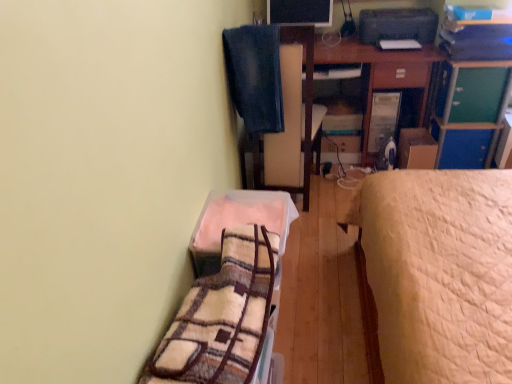
The image size is (512, 384). Describe the element at coordinates (473, 91) in the screenshot. I see `green matte file cabinet at upper right` at that location.

Where is `denim at upper center, placed as the first blanket when sorted from top to bottom`? The width and height of the screenshot is (512, 384). denim at upper center, placed as the first blanket when sorted from top to bottom is located at coordinates (255, 76).

What do you see at coordinates (255, 76) in the screenshot? Image resolution: width=512 pixels, height=384 pixels. I see `denim at upper center, the second blanket when ordered from bottom to top` at bounding box center [255, 76].

How much space does plush beige blanket at lower center, acting as the 1th blanket starting from the bottom, occupy vertically?

plush beige blanket at lower center, acting as the 1th blanket starting from the bottom, is 7.21 inches tall.

This screenshot has width=512, height=384. What do you see at coordinates (380, 72) in the screenshot?
I see `wooden desk at upper right` at bounding box center [380, 72].

You are a GUI agent. You are given a task and a screenshot of the screen. Output one action in this format:
    pyautogui.click(x=<x>, y=<y>)
    Task: Click on the denim fabric swivel chair at upper center
    
    Given the screenshot: What is the action you would take?
    pos(305,111)

Is green matte file cabinet at upper right bigger or smaller than fuzzy fabric blanket at lower left?

In the image, green matte file cabinet at upper right appears to be smaller than fuzzy fabric blanket at lower left.

Between green matte file cabinet at upper right and fuzzy fabric blanket at lower left, which one appears on the right side from the viewer's perspective?

Positioned to the right is green matte file cabinet at upper right.

Can you confirm if green matte file cabinet at upper right is taller than fuzzy fabric blanket at lower left?

Correct, green matte file cabinet at upper right is much taller as fuzzy fabric blanket at lower left.

From a real-world perspective, does green matte file cabinet at upper right stand above fuzzy fabric blanket at lower left?

Yes.

Considering the positions of objects plush beige blanket at lower center, placed as the 2th blanket when sorted from top to bottom, and wooden desk at upper right in the image provided, who is more to the left, plush beige blanket at lower center, placed as the 2th blanket when sorted from top to bottom, or wooden desk at upper right?

Positioned to the left is plush beige blanket at lower center, placed as the 2th blanket when sorted from top to bottom.

Who is taller, plush beige blanket at lower center, acting as the first blanket starting from the front, or wooden desk at upper right?

wooden desk at upper right.

From a real-world perspective, relative to wooden desk at upper right, is plush beige blanket at lower center, positioned as the 2th blanket in back-to-front order, vertically above or below?

plush beige blanket at lower center, positioned as the 2th blanket in back-to-front order, is above wooden desk at upper right.

Is plush beige blanket at lower center, acting as the 1th blanket starting from the bottom, next to wooden desk at upper right?

No, plush beige blanket at lower center, acting as the 1th blanket starting from the bottom, is not beside wooden desk at upper right.

Between matte black monitor at upper center and denim fabric swivel chair at upper center, which one has more height?

Standing taller between the two is denim fabric swivel chair at upper center.

Is matte black monitor at upper center situated inside denim fabric swivel chair at upper center or outside?

matte black monitor at upper center exists outside the volume of denim fabric swivel chair at upper center.

Does matte black monitor at upper center have a larger size compared to denim fabric swivel chair at upper center?

No, matte black monitor at upper center is not bigger than denim fabric swivel chair at upper center.

Between matte black monitor at upper center and denim fabric swivel chair at upper center, which one appears on the right side from the viewer's perspective?

matte black monitor at upper center is more to the right.

Considering the relative positions of wooden desk at upper right and green matte file cabinet at upper right in the image provided, is wooden desk at upper right behind green matte file cabinet at upper right?

Yes, wooden desk at upper right is further from the viewer.

In terms of height, does wooden desk at upper right look taller or shorter compared to green matte file cabinet at upper right?

In the image, wooden desk at upper right appears to be taller than green matte file cabinet at upper right.

Is wooden desk at upper right outside of green matte file cabinet at upper right?

Yes, wooden desk at upper right is located beyond the bounds of green matte file cabinet at upper right.

In the scene shown: Is plush beige blanket at lower center, acting as the first blanket starting from the front, taller or shorter than denim at upper center, placed as the first blanket when sorted from top to bottom?

plush beige blanket at lower center, acting as the first blanket starting from the front, is shorter than denim at upper center, placed as the first blanket when sorted from top to bottom.

Is there a large distance between plush beige blanket at lower center, positioned as the 2th blanket in back-to-front order, and denim at upper center, which is the 1th blanket from back to front?

No, plush beige blanket at lower center, positioned as the 2th blanket in back-to-front order, is not far away from denim at upper center, which is the 1th blanket from back to front.

How different are the orientations of plush beige blanket at lower center, acting as the 1th blanket starting from the bottom, and denim at upper center, which is the 1th blanket from back to front, in degrees?

The angle between the facing direction of plush beige blanket at lower center, acting as the 1th blanket starting from the bottom, and the facing direction of denim at upper center, which is the 1th blanket from back to front, is 85.7 degrees.

Is plush beige blanket at lower center, acting as the 1th blanket starting from the bottom, in front of or behind denim at upper center, placed as the first blanket when sorted from top to bottom, in the image?

plush beige blanket at lower center, acting as the 1th blanket starting from the bottom, is positioned closer to the viewer than denim at upper center, placed as the first blanket when sorted from top to bottom.

Considering the positions of point (272, 8) and point (205, 225), is point (272, 8) closer or farther from the camera than point (205, 225)?

Point (272, 8).

The height and width of the screenshot is (384, 512). In order to click on computer monitor located above the plush beige blanket at lower center, positioned as the 2th blanket in back-to-front order (from the image's perspective) in this screenshot , I will do `click(300, 12)`.

From a real-world perspective, is matte black monitor at upper center physically located above or below plush beige blanket at lower center, acting as the first blanket starting from the front?

From a real-world perspective, matte black monitor at upper center is physically above plush beige blanket at lower center, acting as the first blanket starting from the front.

Can you confirm if matte black monitor at upper center is thinner than plush beige blanket at lower center, acting as the 1th blanket starting from the bottom?

Indeed, matte black monitor at upper center has a lesser width compared to plush beige blanket at lower center, acting as the 1th blanket starting from the bottom.

Considering the relative sizes of denim fabric swivel chair at upper center and denim at upper center, placed as the first blanket when sorted from top to bottom, in the image provided, is denim fabric swivel chair at upper center wider than denim at upper center, placed as the first blanket when sorted from top to bottom,?

Indeed, denim fabric swivel chair at upper center has a greater width compared to denim at upper center, placed as the first blanket when sorted from top to bottom.

Is denim fabric swivel chair at upper center to the left or to the right of denim at upper center, the second blanket in the front-to-back sequence, in the image?

denim fabric swivel chair at upper center is positioned on denim at upper center, the second blanket in the front-to-back sequence,'s right side.

Could you tell me if denim fabric swivel chair at upper center is facing denim at upper center, which is the 1th blanket from back to front?

Yes, denim fabric swivel chair at upper center is oriented towards denim at upper center, which is the 1th blanket from back to front.

Considering the points (306, 195) and (278, 63), which point is in front, point (306, 195) or point (278, 63)?

Positioned in front is point (278, 63).

Locate an element on the screen. The width and height of the screenshot is (512, 384). file cabinet on the right of fuzzy fabric blanket at lower left is located at coordinates [473, 91].

At what (x,y) coordinates should I click in order to perform the action: click on table below the plush beige blanket at lower center, acting as the 1th blanket starting from the bottom (from a real-world perspective). Please return your answer as a coordinate pair (x, y). The height and width of the screenshot is (384, 512). Looking at the image, I should click on (380, 72).

Which object lies nearer to the anchor point denim at upper center, the second blanket when ordered from bottom to top, fuzzy fabric blanket at lower left or wooden desk at upper right?

The object closer to denim at upper center, the second blanket when ordered from bottom to top, is wooden desk at upper right.

Looking at the image, which one is located further to plush beige blanket at lower center, acting as the 1th blanket starting from the bottom, denim fabric swivel chair at upper center or green matte file cabinet at upper right?

The object further to plush beige blanket at lower center, acting as the 1th blanket starting from the bottom, is green matte file cabinet at upper right.

Considering their positions, is denim at upper center, the second blanket in the front-to-back sequence, positioned further to green matte file cabinet at upper right than plush beige blanket at lower center, acting as the 1th blanket starting from the bottom?

plush beige blanket at lower center, acting as the 1th blanket starting from the bottom.

Based on their spatial positions, is fuzzy fabric blanket at lower left or denim at upper center, placed as the first blanket when sorted from top to bottom, further from wooden desk at upper right?

The object further to wooden desk at upper right is fuzzy fabric blanket at lower left.

Based on their spatial positions, is fuzzy fabric blanket at lower left or green matte file cabinet at upper right further from matte black monitor at upper center?

Among the two, fuzzy fabric blanket at lower left is located further to matte black monitor at upper center.

Considering their positions, is fuzzy fabric blanket at lower left positioned further to denim fabric swivel chair at upper center than plush beige blanket at lower center, placed as the 2th blanket when sorted from top to bottom?

fuzzy fabric blanket at lower left is positioned further to the anchor denim fabric swivel chair at upper center.

Consider the image. Looking at the image, which one is located closer to fuzzy fabric blanket at lower left, green matte file cabinet at upper right or matte black monitor at upper center?

The object closer to fuzzy fabric blanket at lower left is green matte file cabinet at upper right.

Which object lies further to the anchor point matte black monitor at upper center, fuzzy fabric blanket at lower left or denim fabric swivel chair at upper center?

The object further to matte black monitor at upper center is fuzzy fabric blanket at lower left.

This screenshot has height=384, width=512. Identify the location of table situated between matte black monitor at upper center and green matte file cabinet at upper right from left to right. (380, 72).

The width and height of the screenshot is (512, 384). In order to click on table situated between denim at upper center, placed as the first blanket when sorted from top to bottom, and green matte file cabinet at upper right from left to right in this screenshot , I will do `click(380, 72)`.

Locate an element on the screen. blanket between matte black monitor at upper center and plush beige blanket at lower center, acting as the first blanket starting from the front, in the up-down direction is located at coordinates (255, 76).

Find the location of a particular element. This screenshot has width=512, height=384. table that lies between matte black monitor at upper center and plush beige blanket at lower center, positioned as the 2th blanket in back-to-front order, from top to bottom is located at coordinates (380, 72).